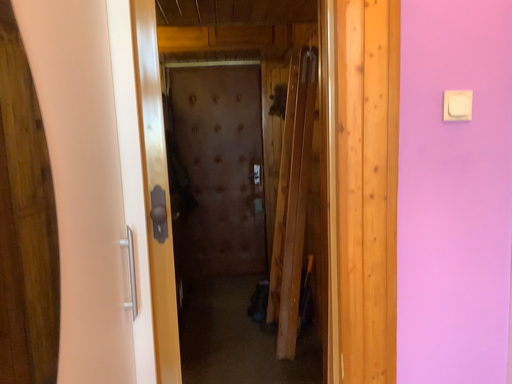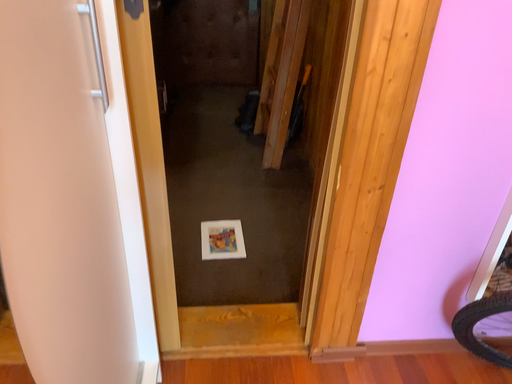
Question: How did the camera likely rotate when shooting the video?

Choices:
 (A) rotated upward
 (B) rotated downward

Answer: (B)